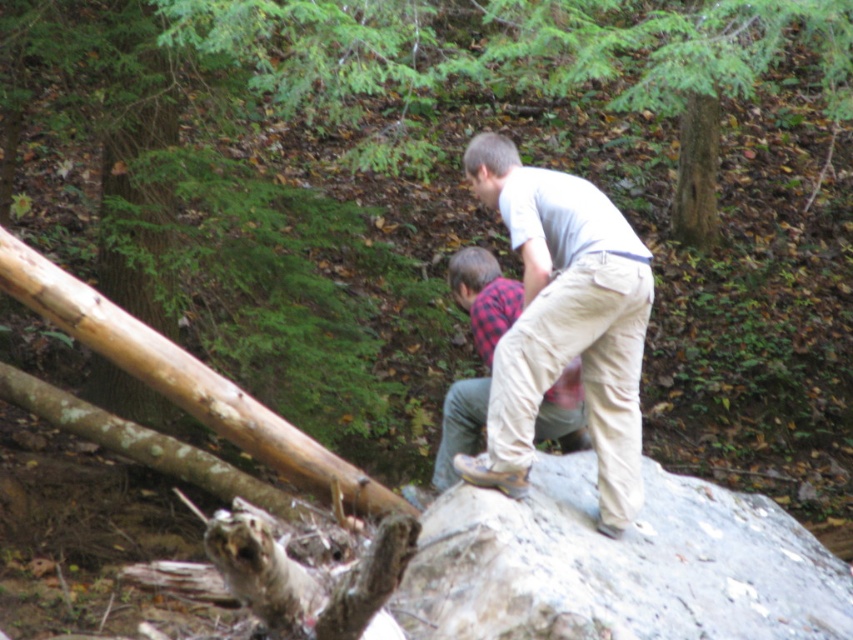
You are a hiker trying to cross a rocky path. You notice the gray rough rock at center and the light beige cotton pants at center. Which object is closer to the ground?

The gray rough rock at center is positioned under the light beige cotton pants at center, so the gray rough rock at center is closer to the ground.

In the scene shown: You are a hiker who has just arrived at this forest scene. You need to locate the gray rough rock at center. Based on the coordinates provided, where should you look to find it?

The gray rough rock at center is located at coordinates point (618, 564), so you should look towards the lower right corner of the scene where the large rock is prominently featured.

In the scene shown: You are a photographer trying to capture a closeup shot of the gray rough rock at center and the plaid fabric shirt at center in the forest scene. The camera you have can only focus on objects within a 20 inch range. Can you fit both objects in the frame without moving the camera?

The gray rough rock at center and plaid fabric shirt at center are 22.86 inches apart from each other. Since the distance between them exceeds the camera focus range of 20 inches, you cannot fit both objects in the frame without moving the camera.